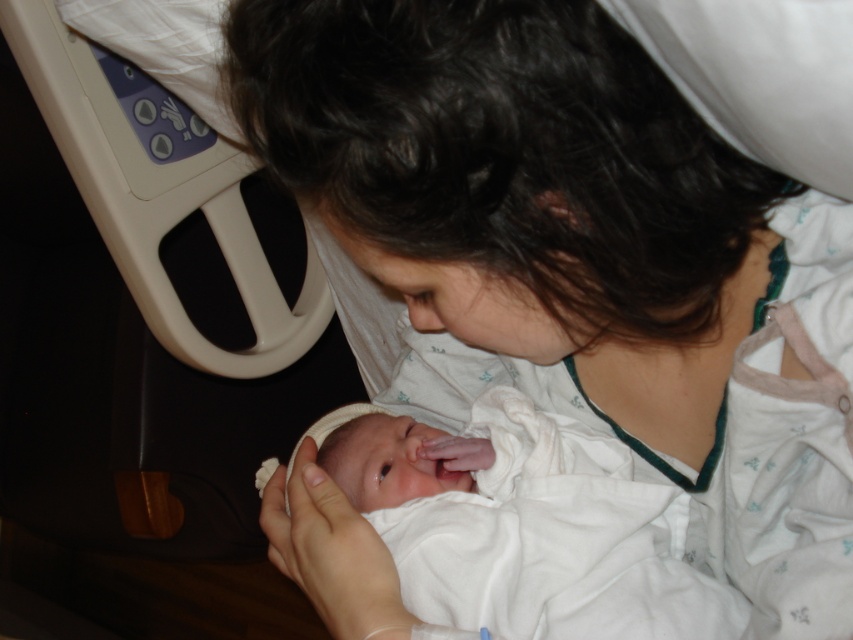
Is point (676, 120) farther from viewer compared to point (375, 428)?

No.

Between point (654, 285) and point (500, 634), which one is positioned in front?

Point (654, 285) is more forward.

Locate an element on the screen. The height and width of the screenshot is (640, 853). white fabric at center is located at coordinates (582, 259).